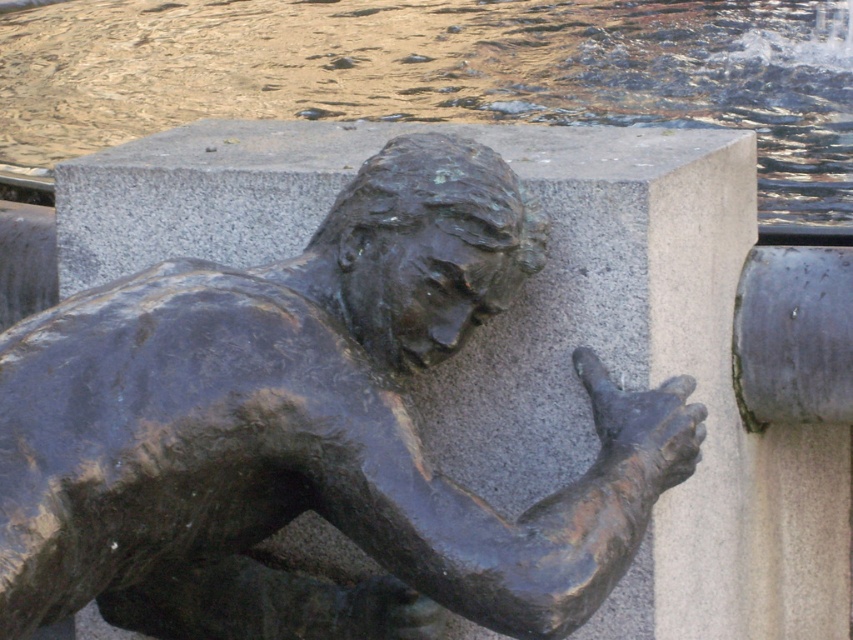
Question: Does bronze statue at center appear on the right side of glistening water at upper center?

Choices:
 (A) no
 (B) yes

Answer: (A)

Question: Where is bronze statue at center located in relation to glistening water at upper center in the image?

Choices:
 (A) left
 (B) right

Answer: (A)

Question: Which point appears closest to the camera in this image?

Choices:
 (A) (312, 294)
 (B) (651, 96)

Answer: (A)

Question: Which point is closer to the camera?

Choices:
 (A) bronze statue at center
 (B) glistening water at upper center

Answer: (A)

Question: Is bronze statue at center positioned behind glistening water at upper center?

Choices:
 (A) no
 (B) yes

Answer: (A)